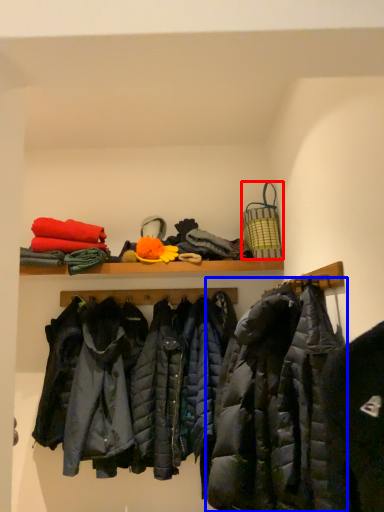
Question: Which object is closer to the camera taking this photo, basket (highlighted by a red box) or jacket (highlighted by a blue box)?

Choices:
 (A) basket
 (B) jacket

Answer: (B)